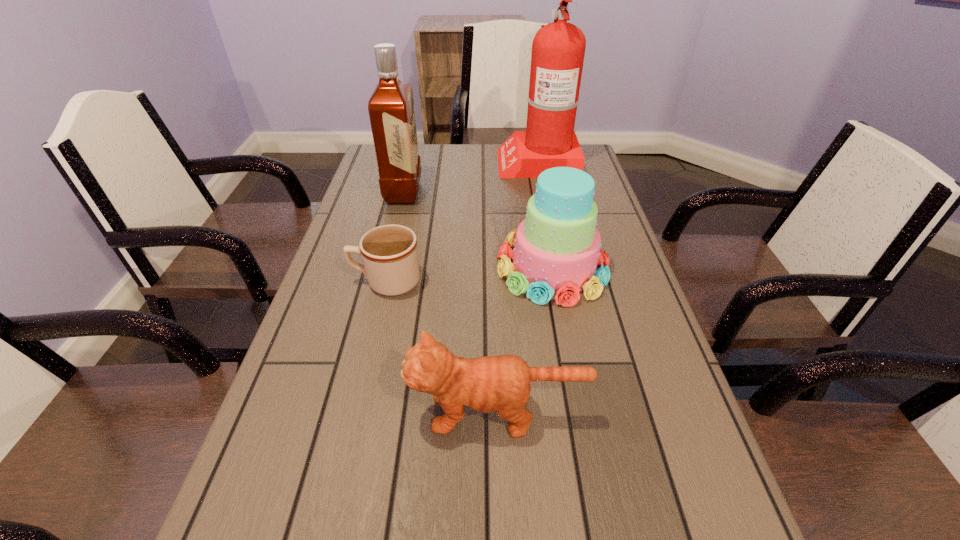
The width and height of the screenshot is (960, 540). Find the location of `cake that is positioned at the right edge`. cake that is positioned at the right edge is located at coordinates (557, 248).

Where is `object positioned at the far right corner`? The image size is (960, 540). object positioned at the far right corner is located at coordinates (558, 49).

In the image, there is a desktop. Identify the location of vacant space at the far edge. (437, 166).

In the image, there is a desktop. Identify the location of vacant region at the left edge. The height and width of the screenshot is (540, 960). (346, 261).

This screenshot has height=540, width=960. I want to click on free space at the right edge of the desktop, so click(578, 312).

Identify the location of blank region between the nearest object and the fourth nearest object. Image resolution: width=960 pixels, height=540 pixels. (450, 302).

This screenshot has height=540, width=960. Identify the location of free space between the liquor and the farthest object. (470, 177).

You are a GUI agent. You are given a task and a screenshot of the screen. Output one action in this format:
    pyautogui.click(x=<x>, y=<y>)
    Task: Click on the empty space that is in between the cake and the second farthest object
    
    Given the screenshot: What is the action you would take?
    pos(478,230)

Find the location of a particular element. The width and height of the screenshot is (960, 540). free space between the shortest object and the fire extinguisher is located at coordinates (462, 221).

In order to click on the closest object to the third shortest object in this screenshot , I will do `click(389, 252)`.